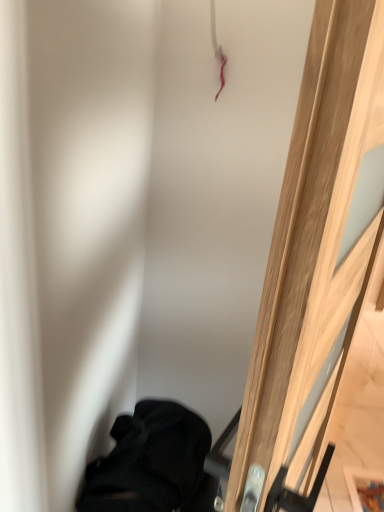
Question: Is wooden door at right further to the viewer compared to black fabric at lower left?

Choices:
 (A) no
 (B) yes

Answer: (A)

Question: From a real-world perspective, is wooden door at right on black fabric at lower left?

Choices:
 (A) no
 (B) yes

Answer: (B)

Question: From the image's perspective, is wooden door at right under black fabric at lower left?

Choices:
 (A) no
 (B) yes

Answer: (A)

Question: Considering the relative sizes of wooden door at right and black fabric at lower left in the image provided, is wooden door at right taller than black fabric at lower left?

Choices:
 (A) yes
 (B) no

Answer: (A)

Question: Does wooden door at right have a greater width compared to black fabric at lower left?

Choices:
 (A) yes
 (B) no

Answer: (B)

Question: Is wooden door at right thinner than black fabric at lower left?

Choices:
 (A) yes
 (B) no

Answer: (A)

Question: Is black fabric at lower left far from wooden door at right?

Choices:
 (A) no
 (B) yes

Answer: (A)

Question: From a real-world perspective, is black fabric at lower left beneath wooden door at right?

Choices:
 (A) yes
 (B) no

Answer: (A)

Question: Is black fabric at lower left facing away from wooden door at right?

Choices:
 (A) no
 (B) yes

Answer: (A)

Question: Considering the relative positions of black fabric at lower left and wooden door at right in the image provided, is black fabric at lower left in front of wooden door at right?

Choices:
 (A) yes
 (B) no

Answer: (B)

Question: Could you tell me if black fabric at lower left is turned towards wooden door at right?

Choices:
 (A) no
 (B) yes

Answer: (B)

Question: From the image's perspective, is black fabric at lower left located above wooden door at right?

Choices:
 (A) yes
 (B) no

Answer: (B)

Question: Which is correct: black fabric at lower left is inside wooden door at right, or outside of it?

Choices:
 (A) outside
 (B) inside

Answer: (A)